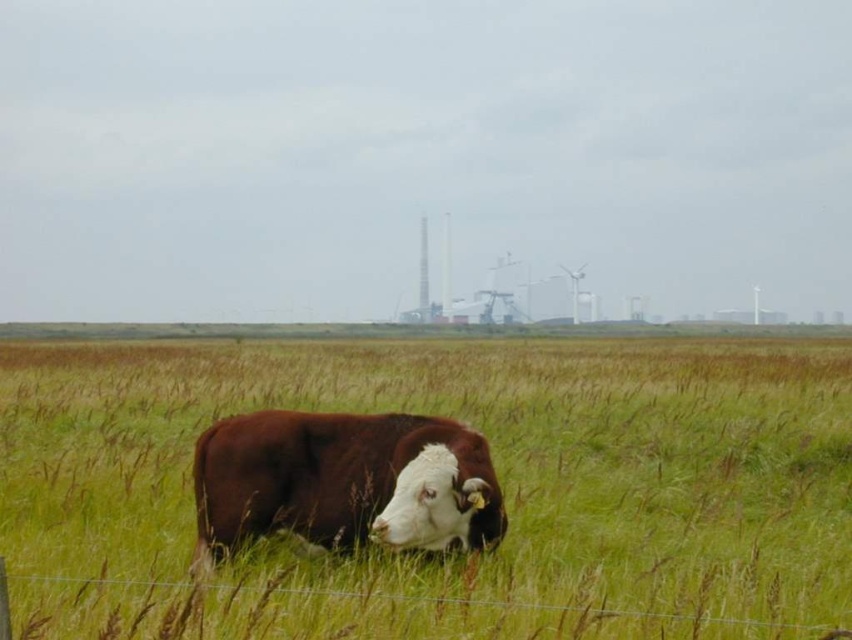
You are standing in the middle of the green grassy field at center and want to reach the brown matte cow at center. Which direction should you move to get closer to the cow?

The green grassy field at center is located above the brown matte cow at center, so you should move downward to reach the brown matte cow at center.

You are standing in the middle of the green grassy field at center and looking towards the brown matte cow at center. Which object is closer to you?

The green grassy field at center is closer to you than the brown matte cow at center.